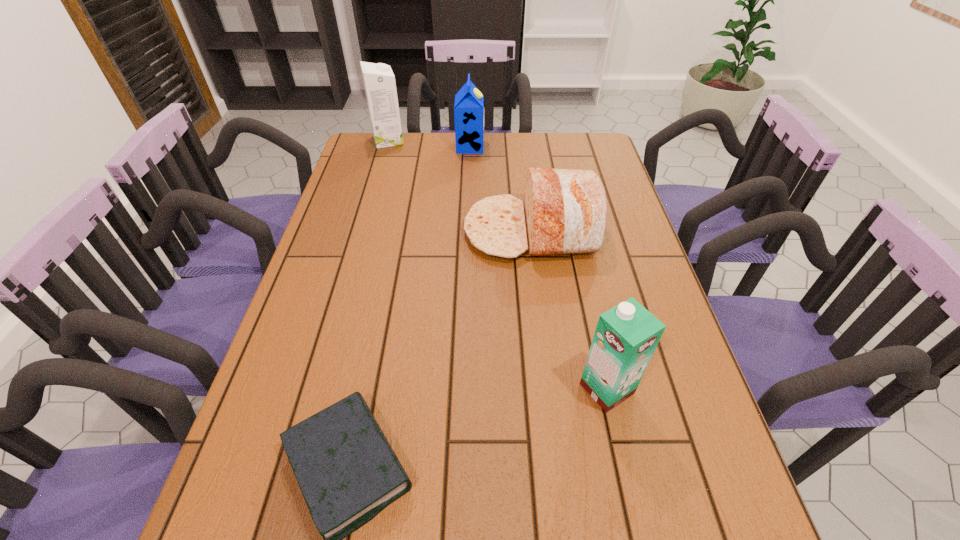
Locate an element on the screen. free space that satisfies the following two spatial constraints: 1. with the cap open on the nearest carton; 2. on the left side of the second carton from right to left is located at coordinates (463, 389).

Find the location of a particular element. This screenshot has height=540, width=960. vacant region that satisfies the following two spatial constraints: 1. at the sliced end of the rightmost carton; 2. on the right side of the fourth tallest object is located at coordinates (551, 389).

Where is `free space that satisfies the following two spatial constraints: 1. with the cap open on the nearest carton; 2. on the left side of the second carton from left to right`? The image size is (960, 540). free space that satisfies the following two spatial constraints: 1. with the cap open on the nearest carton; 2. on the left side of the second carton from left to right is located at coordinates (463, 389).